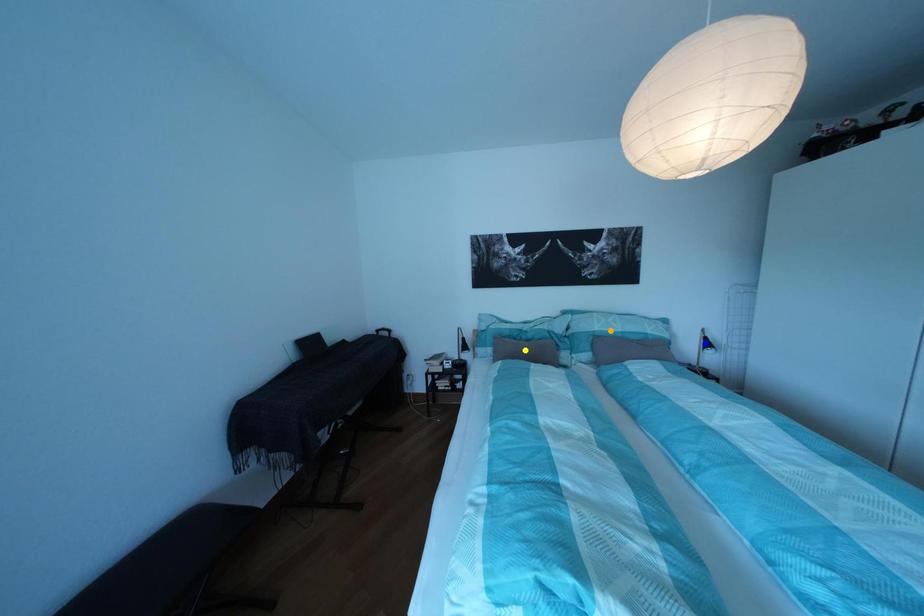
Order these from nearest to farthest:
blue point | orange point | yellow point

yellow point
orange point
blue point